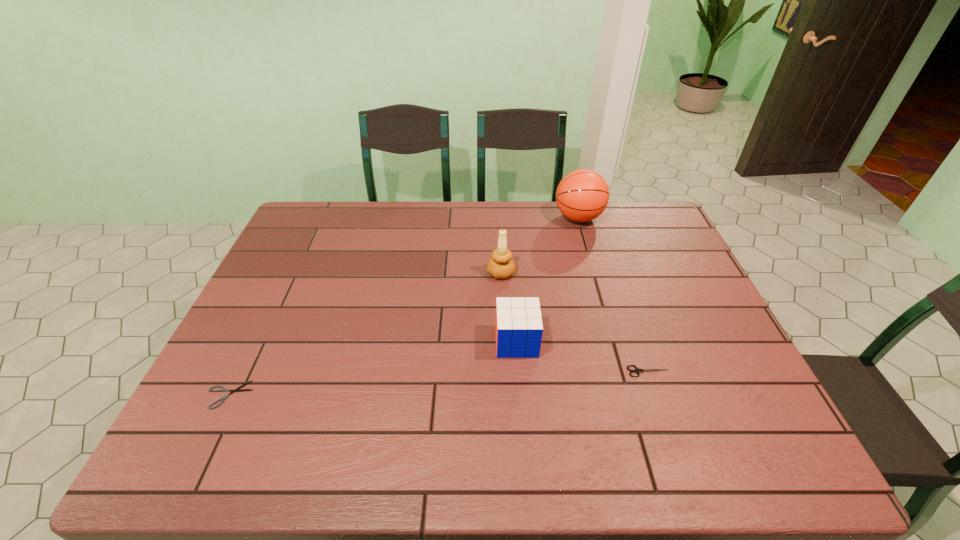
The image size is (960, 540). I want to click on vacant space located on the right of the third tallest object, so click(684, 341).

This screenshot has width=960, height=540. What are the coordinates of `vacant space located 0.240m on the back of the taller shears` in the screenshot? It's located at (623, 297).

At what (x,y) coordinates should I click in order to perform the action: click on free space located 0.080m on the front of the left shears. Please return your answer as a coordinate pair (x, y). Looking at the image, I should click on (205, 443).

This screenshot has height=540, width=960. Identify the location of object that is at the far edge. (582, 195).

Locate an element on the screen. The height and width of the screenshot is (540, 960). object located in the left edge section of the desktop is located at coordinates (238, 389).

Identify the location of free location at the far edge of the desktop. The image size is (960, 540). (448, 208).

Where is `blank space at the near edge`? blank space at the near edge is located at coordinates (x=578, y=471).

Where is `vacant space at the left edge of the desktop`? The image size is (960, 540). vacant space at the left edge of the desktop is located at coordinates (296, 266).

Identify the location of free location at the right edge. (768, 424).

Locate an element on the screen. This screenshot has height=540, width=960. vacant space at the far left corner of the desktop is located at coordinates (300, 225).